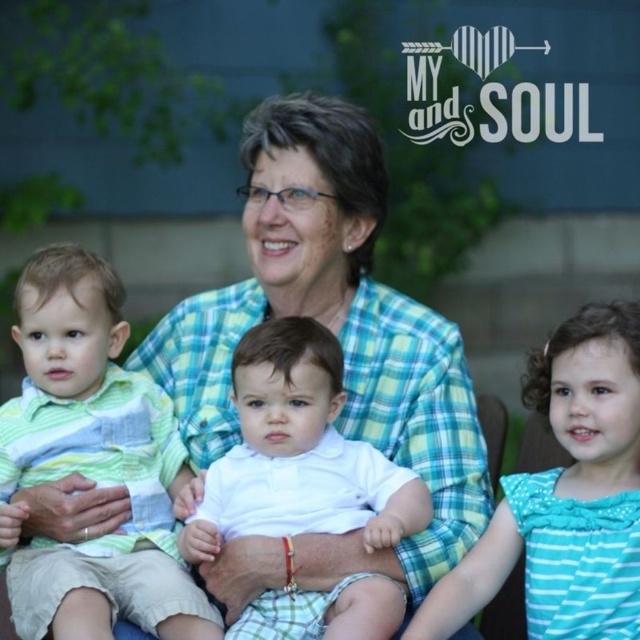
You are standing 10 feet away from the camera. Can you see the green striped shirt at left?

The green striped shirt at left and camera are 13.38 feet apart. Since you are only 10 feet away from the camera, you are closer to the camera than the green striped shirt at left, so you can see the green striped shirt at left.

Based on the photo, where is the green plaid shirt at center located in the image?

The green plaid shirt at center is located at point coordinates of (340, 344).